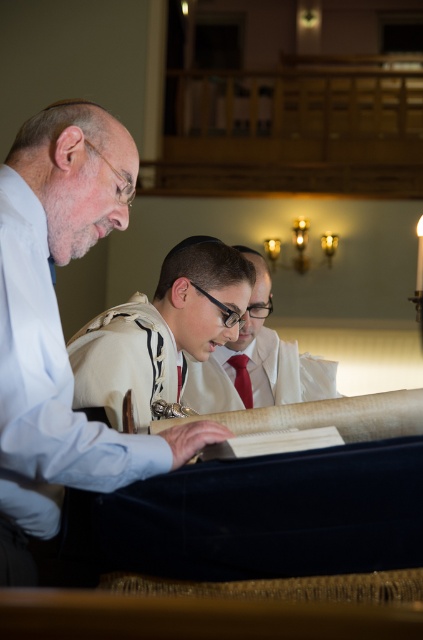
Is point (107, 488) positioned behind point (200, 269)?

No, it is not.

The height and width of the screenshot is (640, 423). Identify the location of white fabric kippah at upper center. (60, 326).

Does point (52, 508) lie in front of point (241, 355)?

Yes, it is.

Does white fabric kippah at upper center appear over red satin tie at center?

Yes.

Where is `white fabric kippah at upper center`? The image size is (423, 640). white fabric kippah at upper center is located at coordinates (60, 326).

The image size is (423, 640). Find the location of `white fabric kippah at upper center`. white fabric kippah at upper center is located at coordinates (60, 326).

Is matte white kippah at center closer to camera compared to red satin tie at center?

Yes, it is.

Which is more to the right, matte white kippah at center or red satin tie at center?

Positioned to the right is red satin tie at center.

Where is `matte white kippah at center`? The image size is (423, 640). matte white kippah at center is located at coordinates (162, 330).

You are a GUI agent. You are given a task and a screenshot of the screen. Output one action in this format:
    pyautogui.click(x=<x>, y=<y>)
    Task: Click on the matte white kippah at center
    This screenshot has height=640, width=423.
    Given the screenshot: What is the action you would take?
    [x=162, y=330]